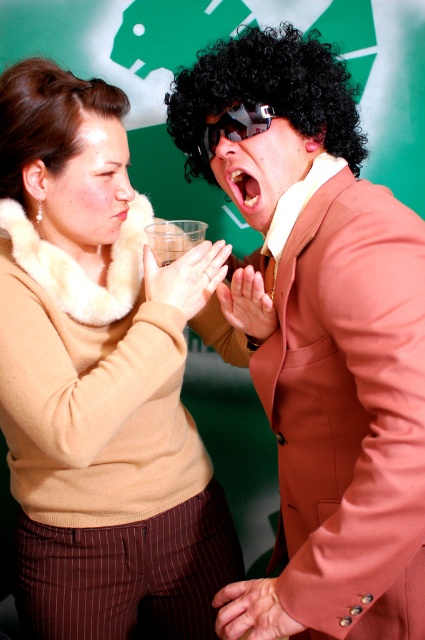
Question: Is brown matte suit at center to the left of black curly wig at upper left from the viewer's perspective?

Choices:
 (A) no
 (B) yes

Answer: (A)

Question: Among these objects, which one is farthest from the camera?

Choices:
 (A) beige fur sweater at center
 (B) black matte goggles at center
 (C) black curly wig at upper left

Answer: (C)

Question: Which point is closer to the camera?

Choices:
 (A) (368, 189)
 (B) (79, 156)
 (C) (6, 84)
 (D) (223, 124)

Answer: (A)

Question: Does black curly wig at center have a lesser width compared to black matte goggles at center?

Choices:
 (A) no
 (B) yes

Answer: (A)

Question: Is brown matte suit at center below black matte goggles at center?

Choices:
 (A) yes
 (B) no

Answer: (A)

Question: Which point is closer to the camera?

Choices:
 (A) black curly wig at upper left
 (B) black matte goggles at center
 (C) brown matte suit at center
 (D) black curly wig at center

Answer: (C)